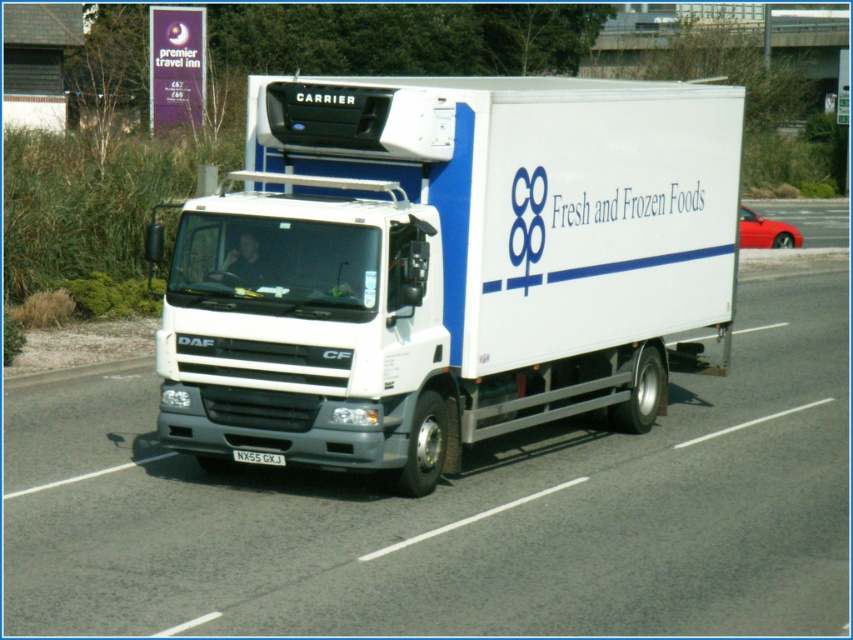
Question: From the image, what is the correct spatial relationship of white matte truck at center in relation to black plastic license plate at center?

Choices:
 (A) below
 (B) above

Answer: (B)

Question: Can you confirm if white matte truck at center is positioned to the right of white glossy truck at center?

Choices:
 (A) yes
 (B) no

Answer: (A)

Question: Which point appears farthest from the camera in this image?

Choices:
 (A) (244, 456)
 (B) (701, 445)

Answer: (B)

Question: Among these points, which one is nearest to the camera?

Choices:
 (A) (248, 452)
 (B) (601, 237)

Answer: (A)

Question: Estimate the real-world distances between objects in this image. Which object is farther from the black plastic license plate at center?

Choices:
 (A) white glossy truck at center
 (B) white matte truck at center

Answer: (A)

Question: Is white glossy truck at center bigger than black plastic license plate at center?

Choices:
 (A) yes
 (B) no

Answer: (A)